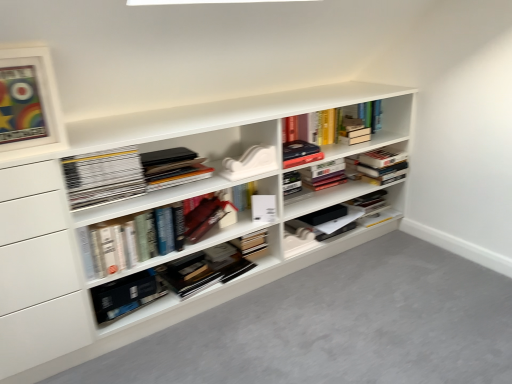
This screenshot has height=384, width=512. Identify the location of free space above hardcover books at center, acting as the 3th book starting from the top (from a real-world perspective). (128, 202).